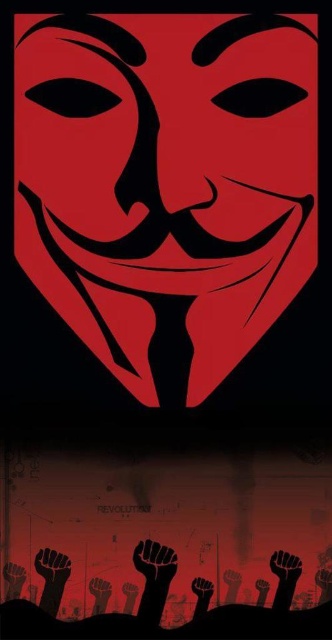
You are standing in a gallery where the matte red mask at center is displayed. The gallery has a strict rule that visitors must stay at least 10 meters away from all exhibits. Are you currently violating this rule?

The matte red mask at center is 8.26 meters from viewer, so yes, you are violating the rule since you are closer than the required 10 meters.

Based on the coordinates provided, where is the matte red mask at center located in the image?

Answer: The matte red mask at center is located at the coordinates point [167,182].